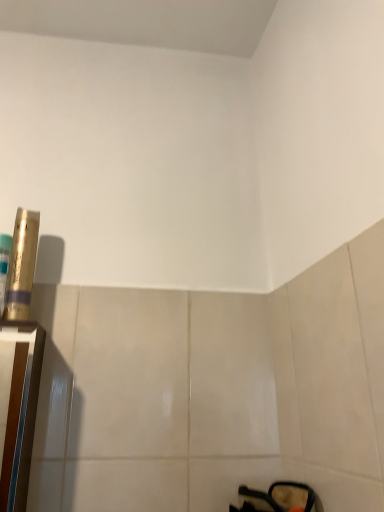
This screenshot has width=384, height=512. In order to click on gold metallic tube at left in this screenshot , I will do `click(21, 265)`.

In order to face gold metallic tube at left, should I rotate leftwards or rightwards?

A 21.314 degree turn to the left will do.

What do you see at coordinates (21, 265) in the screenshot?
I see `gold metallic tube at left` at bounding box center [21, 265].

Identify the location of gold metallic tube at left. This screenshot has width=384, height=512. (x=21, y=265).